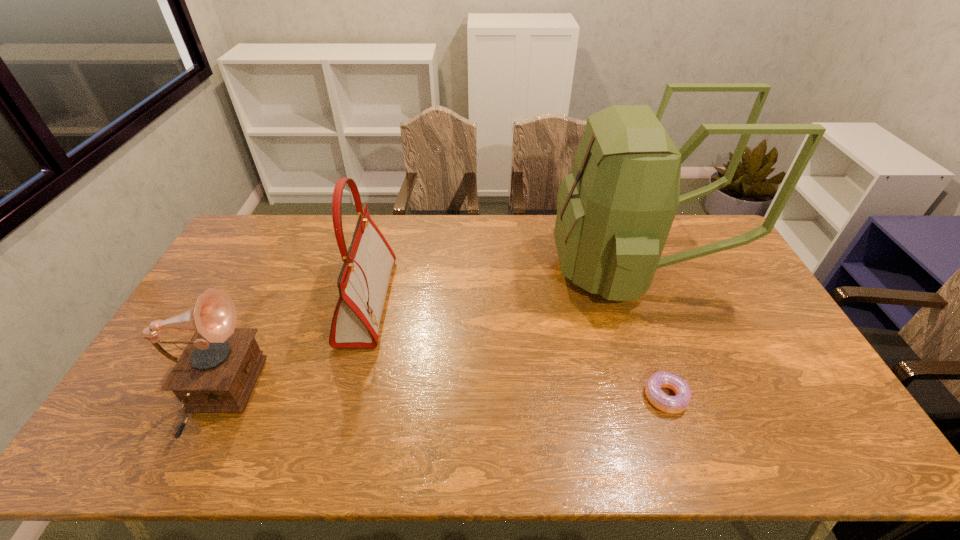
Locate an element on the screen. The image size is (960, 540). vacant space at the left edge is located at coordinates (254, 271).

In the image, there is a desktop. At what (x,y) coordinates should I click in order to perform the action: click on vacant space at the right edge. Please return your answer as a coordinate pair (x, y). This screenshot has height=540, width=960. Looking at the image, I should click on (766, 352).

Image resolution: width=960 pixels, height=540 pixels. In the image, there is a desktop. Find the location of `blank space at the far right corner`. blank space at the far right corner is located at coordinates (712, 231).

Identify the location of free spot at the near right corner of the desktop. (799, 452).

Find the location of a particular element. This screenshot has width=960, height=540. vacant point located between the second tallest object and the backpack is located at coordinates (501, 285).

Where is `free space between the doughnut and the leftmost object`? The height and width of the screenshot is (540, 960). free space between the doughnut and the leftmost object is located at coordinates pos(440,397).

Where is `vacant space that's between the handbag and the backpack`? The image size is (960, 540). vacant space that's between the handbag and the backpack is located at coordinates (501, 285).

Locate an element on the screen. Image resolution: width=960 pixels, height=540 pixels. free point between the third shortest object and the shortest object is located at coordinates (516, 349).

In order to click on empty space between the backpack and the doughnut in this screenshot , I will do `click(650, 333)`.

The height and width of the screenshot is (540, 960). In order to click on free space between the doughnut and the leftmost object in this screenshot , I will do `click(440, 397)`.